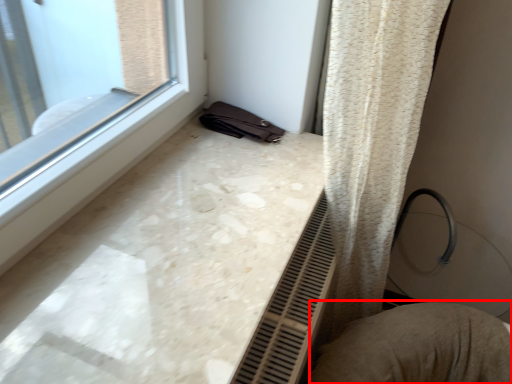
Question: Observing the image, what is the correct spatial positioning of swivel chair (annotated by the red box) in reference to counter top?

Choices:
 (A) right
 (B) left

Answer: (A)